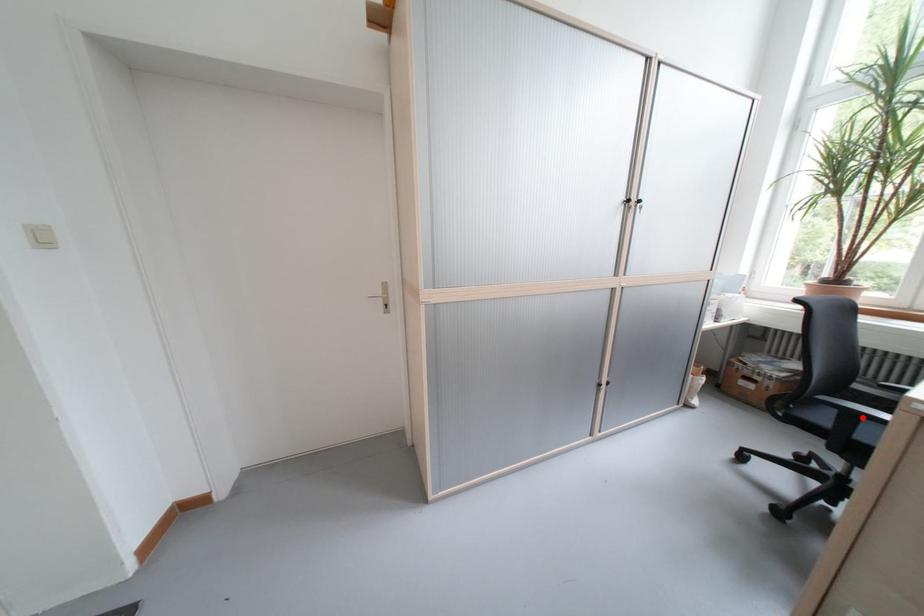
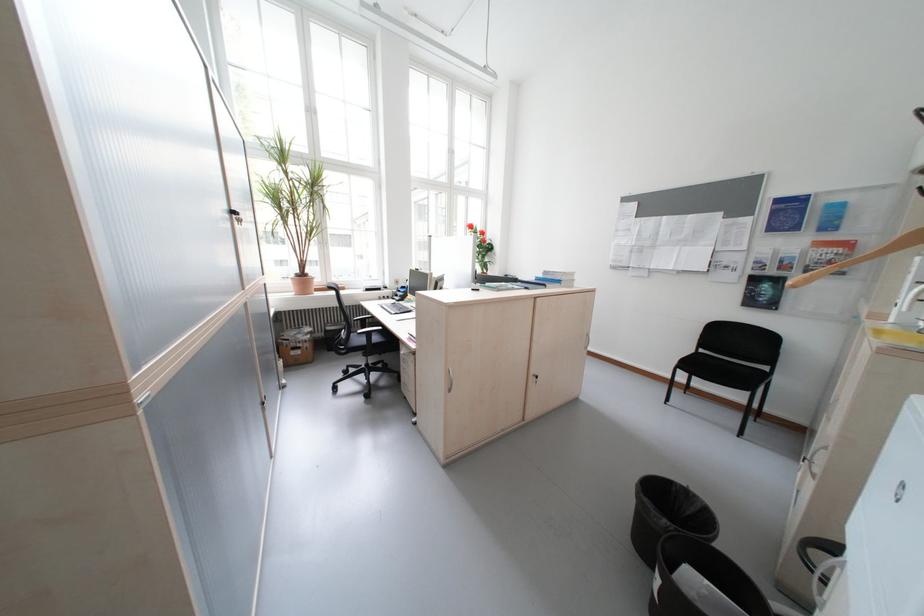
Find the pixel in the second image that matches the highlighted location in the first image.

(380, 334)